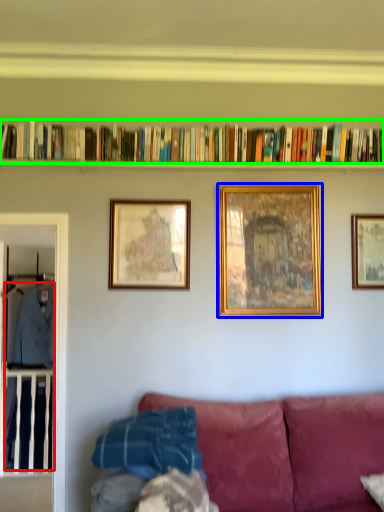
Question: Estimate the real-world distances between objects in this image. Which object is farther from clothing (highlighted by a red box), picture frame (highlighted by a blue box) or book (highlighted by a green box)?

Choices:
 (A) picture frame
 (B) book

Answer: (A)